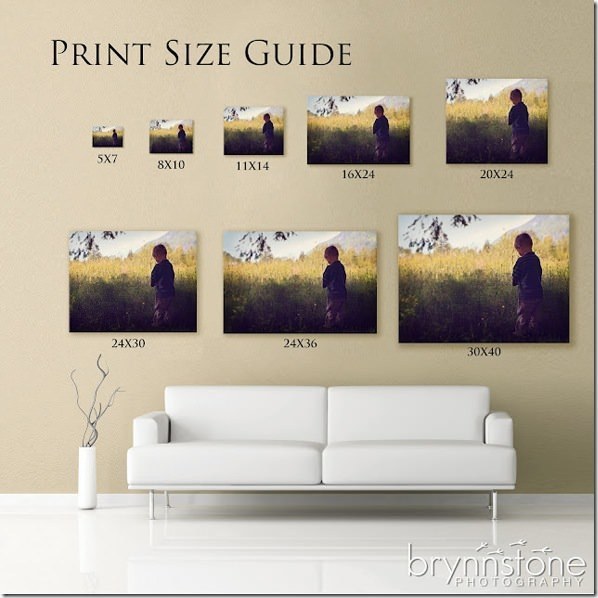
Identify the location of vase. (87, 474).